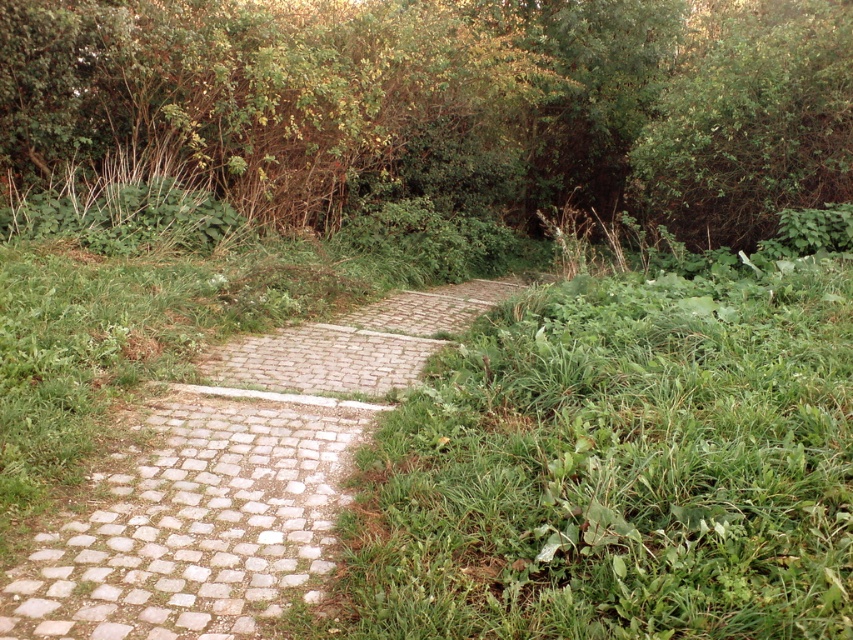
How distant is green leafy bush at upper center from pebble stone path at center?

green leafy bush at upper center is 10.66 meters from pebble stone path at center.

Does green leafy bush at upper center appear under pebble stone path at center?

No.

Find the location of a particular element. green leafy bush at upper center is located at coordinates (440, 106).

Identify the location of green leafy bush at upper center. The width and height of the screenshot is (853, 640). tap(440, 106).